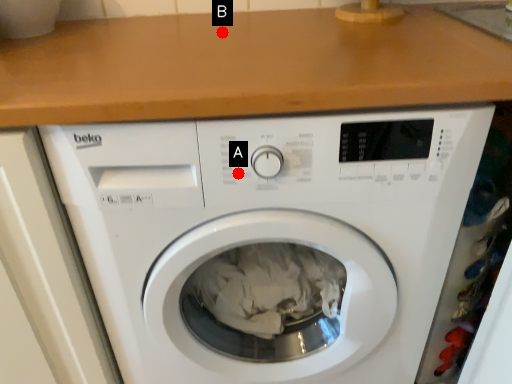
Question: Two points are circled on the image, labeled by A and B beside each circle. Which point is farther from the camera taking this photo?

Choices:
 (A) A is further
 (B) B is further

Answer: (B)